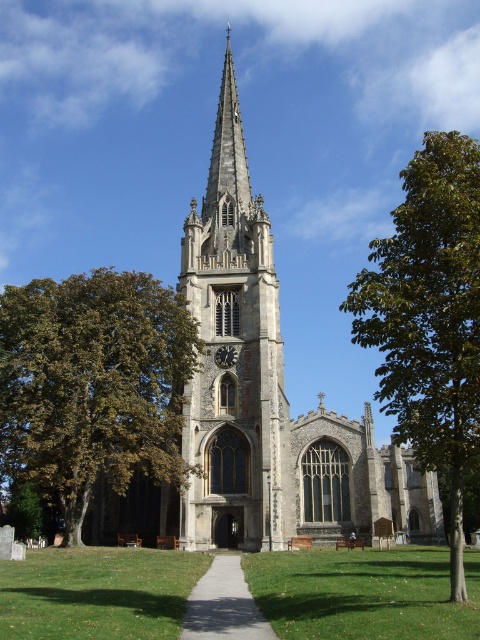
You are a GUI agent. You are given a task and a screenshot of the screen. Output one action in this format:
    pyautogui.click(x=<x>, y=<y>)
    Task: Click on the smooth stone tower at center
    
    Given the screenshot: What is the action you would take?
    pyautogui.click(x=238, y=356)

Who is positioned more to the left, smooth stone tower at center or green leafy tree at right?

smooth stone tower at center is more to the left.

Which is behind, point (199, 541) or point (418, 180)?

Positioned behind is point (199, 541).

You are a GUI agent. You are given a task and a screenshot of the screen. Output one action in this format:
    pyautogui.click(x=<x>, y=<y>)
    Task: Click on the smooth stone tower at center
    This screenshot has height=640, width=480.
    Given the screenshot: What is the action you would take?
    238,356

Between green leafy tree at center and metallic clock face at center, which one is positioned lower?

Positioned lower is metallic clock face at center.

Describe the element at coordinates (93, 385) in the screenshot. The image size is (480, 640). I see `green leafy tree at center` at that location.

Image resolution: width=480 pixels, height=640 pixels. I want to click on green leafy tree at center, so click(x=93, y=385).

Consider the image. How distant is gravel pathway at center from green leafy tree at lower left?

A distance of 23.60 meters exists between gravel pathway at center and green leafy tree at lower left.

Does point (226, 595) come farther from viewer compared to point (6, 522)?

No, (226, 595) is in front of (6, 522).

Is point (187, 614) farther from viewer compared to point (6, 504)?

No.

Where is `gravel pathway at center`? gravel pathway at center is located at coordinates (224, 605).